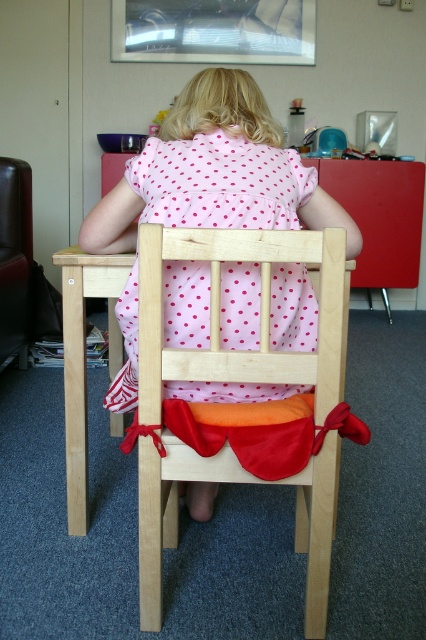
Who is more forward, (250, 173) or (227, 332)?

Point (227, 332) is in front.

Does pink polka dot dress at center appear over pink dotted fabric dress at center?

Yes, pink polka dot dress at center is above pink dotted fabric dress at center.

Between point (302, 218) and point (227, 348), which one is positioned behind?

The point (302, 218) is more distant.

At what (x,y) coordinates should I click in order to perform the action: click on pink polka dot dress at center. Please return your answer as a coordinate pair (x, y). Looking at the image, I should click on (215, 172).

Who is positioned more to the left, pink dotted fabric dress at center or leather couch at left?

Positioned to the left is leather couch at left.

Does pink dotted fabric dress at center have a lesser width compared to leather couch at left?

No, pink dotted fabric dress at center is not thinner than leather couch at left.

Measure the distance between pink dotted fabric dress at center and camera.

3.74 feet

Locate an element on the screen. pink dotted fabric dress at center is located at coordinates (219, 182).

Who is lower down, wooden chair at center or leather couch at left?

wooden chair at center is lower down.

Locate an element on the screen. wooden chair at center is located at coordinates (259, 316).